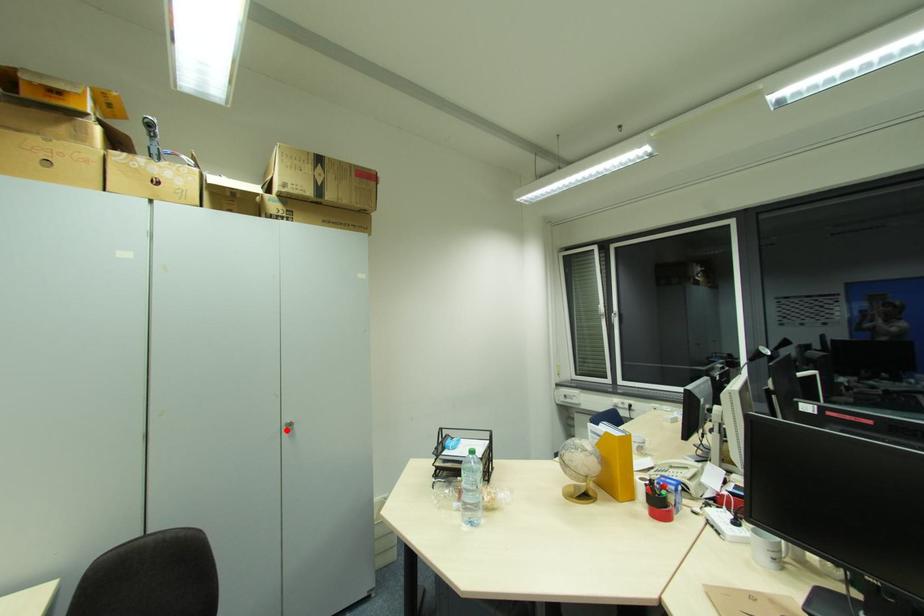
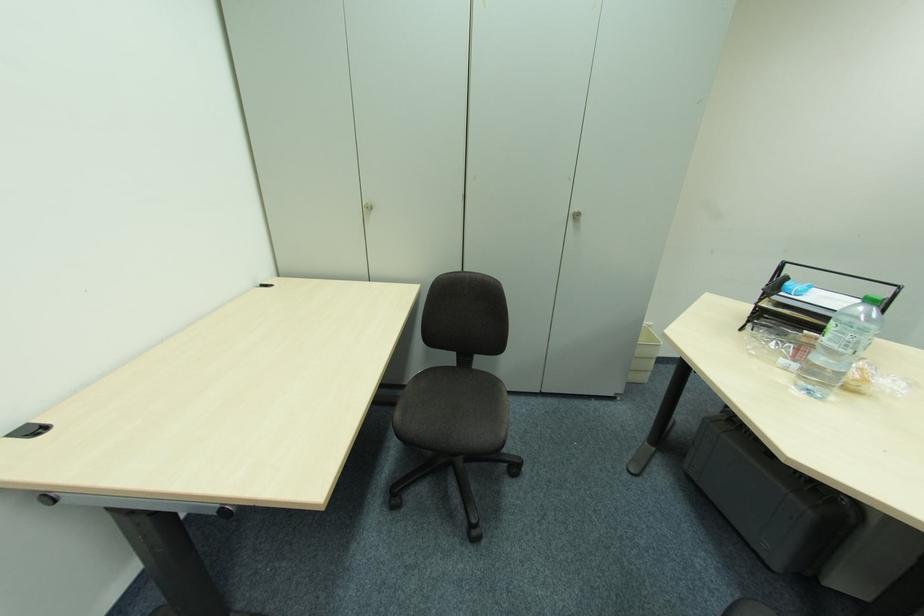
Find the pixel in the second image that matches the highlighted location in the first image.

(574, 219)